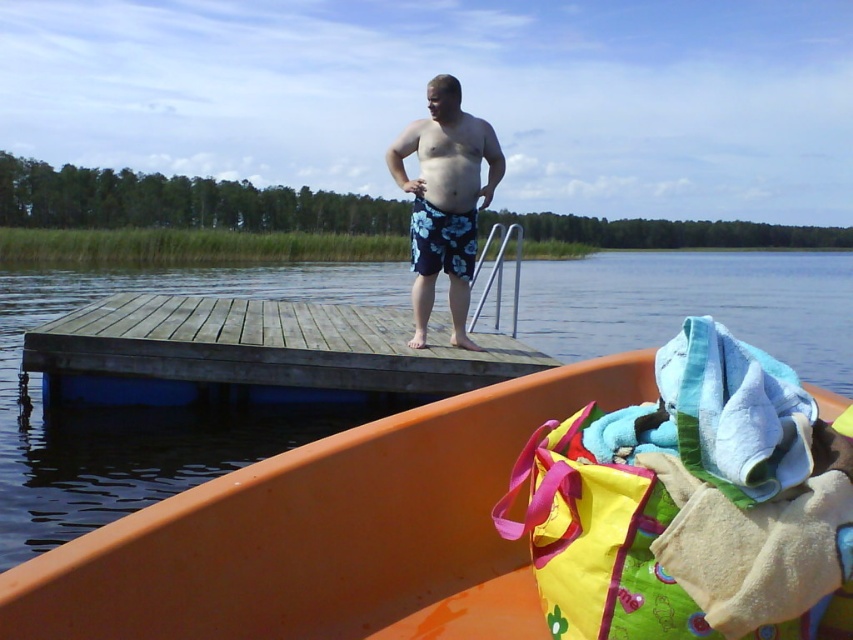
Who is more forward, (x=393, y=545) or (x=218, y=355)?

Point (x=393, y=545) is in front.

Does orange plastic boat at center appear over weathered wood dock at center?

Actually, orange plastic boat at center is below weathered wood dock at center.

Identify the location of orange plastic boat at center. The image size is (853, 640). (328, 532).

Measure the distance between point (26, 356) and camera.

4.93 meters

Identify the location of weathered wood dock at center. This screenshot has height=640, width=853. (256, 353).

This screenshot has height=640, width=853. Identify the location of weathered wood dock at center. tap(256, 353).

Find the location of a particular element. This screenshot has width=853, height=640. weathered wood dock at center is located at coordinates (256, 353).

The width and height of the screenshot is (853, 640). I want to click on orange plastic boat at center, so [328, 532].

Does orange plastic boat at center have a smaller size compared to blue floral shorts at center?

No.

Which is behind, point (325, 515) or point (486, 182)?

The point (486, 182) is behind.

Find the location of a particular element. orange plastic boat at center is located at coordinates (328, 532).